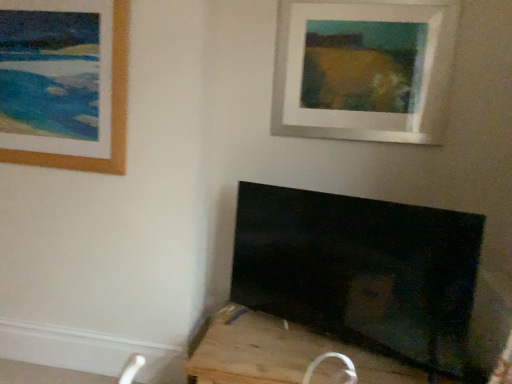
Where is `white matte picture frame at upper center, the first picture frame when ordered from right to left`? Image resolution: width=512 pixels, height=384 pixels. white matte picture frame at upper center, the first picture frame when ordered from right to left is located at coordinates (362, 70).

The image size is (512, 384). What do you see at coordinates (362, 70) in the screenshot?
I see `white matte picture frame at upper center, the second picture frame when ordered from left to right` at bounding box center [362, 70].

The image size is (512, 384). What do you see at coordinates (111, 114) in the screenshot?
I see `wooden frame at upper left, the first picture frame viewed from the left` at bounding box center [111, 114].

At what (x,y) coordinates should I click in order to perform the action: click on black matte tv at lower right. Please return your answer as a coordinate pair (x, y). The width and height of the screenshot is (512, 384). Looking at the image, I should click on (286, 355).

This screenshot has height=384, width=512. Identify the location of white matte picture frame at upper center, the second picture frame when ordered from left to right. (362, 70).

Would you say white matte picture frame at upper center, the second picture frame when ordered from left to right, is outside black matte tv at lower right?

Yes.

Identify the location of the 2nd picture frame behind the black matte tv at lower right, counting from the anchor's position. This screenshot has width=512, height=384. (362, 70).

In the image, is white matte picture frame at upper center, the second picture frame when ordered from left to right, positioned in front of or behind black matte tv at lower right?

Visually, white matte picture frame at upper center, the second picture frame when ordered from left to right, is located behind black matte tv at lower right.

From the image's perspective, who appears lower, white matte picture frame at upper center, the second picture frame when ordered from left to right, or black matte tv at lower right?

From the image's view, black matte tv at lower right is below.

Is wooden frame at upper left, the first picture frame viewed from the left, oriented towards black matte tv at lower right?

No, wooden frame at upper left, the first picture frame viewed from the left, is not oriented towards black matte tv at lower right.

Which point is more forward, (117,26) or (270,351)?

The point (270,351) is in front.

Which object is positioned more to the right, wooden frame at upper left, the 2th picture frame in the right-to-left sequence, or black matte tv at lower right?

black matte tv at lower right is more to the right.

Is the position of wooden frame at upper left, the 2th picture frame in the right-to-left sequence, more distant than that of black matte tv at lower right?

Yes, wooden frame at upper left, the 2th picture frame in the right-to-left sequence, is behind black matte tv at lower right.

Between white matte picture frame at upper center, the second picture frame when ordered from left to right, and wooden frame at upper left, the first picture frame viewed from the left, which one has more height?

Standing taller between the two is wooden frame at upper left, the first picture frame viewed from the left.

Which object is further away from the camera taking this photo, white matte picture frame at upper center, the first picture frame when ordered from right to left, or wooden frame at upper left, the first picture frame viewed from the left?

white matte picture frame at upper center, the first picture frame when ordered from right to left, is further from the camera.

Is white matte picture frame at upper center, the first picture frame when ordered from right to left, at the left side of wooden frame at upper left, the 2th picture frame in the right-to-left sequence?

Incorrect, white matte picture frame at upper center, the first picture frame when ordered from right to left, is not on the left side of wooden frame at upper left, the 2th picture frame in the right-to-left sequence.

Is white matte picture frame at upper center, the first picture frame when ordered from right to left, oriented away from wooden frame at upper left, the 2th picture frame in the right-to-left sequence?

No, white matte picture frame at upper center, the first picture frame when ordered from right to left, is not facing the opposite direction of wooden frame at upper left, the 2th picture frame in the right-to-left sequence.

Does wooden frame at upper left, the 2th picture frame in the right-to-left sequence, contain white matte picture frame at upper center, the second picture frame when ordered from left to right?

No, wooden frame at upper left, the 2th picture frame in the right-to-left sequence, does not contain white matte picture frame at upper center, the second picture frame when ordered from left to right.

Looking at this image, considering the relative positions of wooden frame at upper left, the first picture frame viewed from the left, and white matte picture frame at upper center, the first picture frame when ordered from right to left, in the image provided, is wooden frame at upper left, the first picture frame viewed from the left, behind white matte picture frame at upper center, the first picture frame when ordered from right to left,?

No, wooden frame at upper left, the first picture frame viewed from the left, is closer to the viewer.

In terms of width, does wooden frame at upper left, the 2th picture frame in the right-to-left sequence, look wider or thinner when compared to white matte picture frame at upper center, the first picture frame when ordered from right to left?

In the image, wooden frame at upper left, the 2th picture frame in the right-to-left sequence, appears to be more narrow than white matte picture frame at upper center, the first picture frame when ordered from right to left.

Is wooden frame at upper left, the 2th picture frame in the right-to-left sequence, smaller than white matte picture frame at upper center, the first picture frame when ordered from right to left?

Indeed, wooden frame at upper left, the 2th picture frame in the right-to-left sequence, has a smaller size compared to white matte picture frame at upper center, the first picture frame when ordered from right to left.

In order to click on furniture located underneath the wooden frame at upper left, the first picture frame viewed from the left (from a real-world perspective) in this screenshot , I will do `click(286, 355)`.

Which is further, (234, 378) or (96, 170)?

The point (96, 170) is more distant.

Between black matte tv at lower right and wooden frame at upper left, the 2th picture frame in the right-to-left sequence, which one appears on the right side from the viewer's perspective?

black matte tv at lower right.

This screenshot has width=512, height=384. In order to click on picture frame that is the 2nd one when counting upward from the black matte tv at lower right (from the image's perspective) in this screenshot , I will do `click(362, 70)`.

Considering the relative sizes of black matte tv at lower right and white matte picture frame at upper center, the first picture frame when ordered from right to left, in the image provided, is black matte tv at lower right bigger than white matte picture frame at upper center, the first picture frame when ordered from right to left,?

Yes, black matte tv at lower right is bigger than white matte picture frame at upper center, the first picture frame when ordered from right to left.

From their relative heights in the image, would you say black matte tv at lower right is taller or shorter than white matte picture frame at upper center, the first picture frame when ordered from right to left?

In the image, black matte tv at lower right appears to be shorter than white matte picture frame at upper center, the first picture frame when ordered from right to left.

From the picture: Which object is positioned more to the left, black matte tv at lower right or white matte picture frame at upper center, the first picture frame when ordered from right to left?

From the viewer's perspective, black matte tv at lower right appears more on the left side.

I want to click on furniture in front of the white matte picture frame at upper center, the second picture frame when ordered from left to right, so click(286, 355).

Identify the location of furniture below the wooden frame at upper left, the 2th picture frame in the right-to-left sequence (from the image's perspective). (286, 355).

Which object lies further to the anchor point wooden frame at upper left, the first picture frame viewed from the left, black matte tv at lower right or white matte picture frame at upper center, the second picture frame when ordered from left to right?

black matte tv at lower right is positioned further to the anchor wooden frame at upper left, the first picture frame viewed from the left.

Estimate the real-world distances between objects in this image. Which object is closer to black matte tv at lower right, wooden frame at upper left, the 2th picture frame in the right-to-left sequence, or white matte picture frame at upper center, the second picture frame when ordered from left to right?

wooden frame at upper left, the 2th picture frame in the right-to-left sequence, is positioned closer to the anchor black matte tv at lower right.

In the scene shown: Which object lies nearer to the anchor point black matte tv at lower right, white matte picture frame at upper center, the first picture frame when ordered from right to left, or wooden frame at upper left, the 2th picture frame in the right-to-left sequence?

The object closer to black matte tv at lower right is wooden frame at upper left, the 2th picture frame in the right-to-left sequence.

Estimate the real-world distances between objects in this image. Which object is further from white matte picture frame at upper center, the second picture frame when ordered from left to right, wooden frame at upper left, the 2th picture frame in the right-to-left sequence, or black matte tv at lower right?

black matte tv at lower right is positioned further to the anchor white matte picture frame at upper center, the second picture frame when ordered from left to right.

Considering their positions, is black matte tv at lower right positioned further to white matte picture frame at upper center, the first picture frame when ordered from right to left, than wooden frame at upper left, the 2th picture frame in the right-to-left sequence?

The object further to white matte picture frame at upper center, the first picture frame when ordered from right to left, is black matte tv at lower right.

When comparing their distances from wooden frame at upper left, the first picture frame viewed from the left, does white matte picture frame at upper center, the second picture frame when ordered from left to right, or black matte tv at lower right seem closer?

white matte picture frame at upper center, the second picture frame when ordered from left to right, is closer to wooden frame at upper left, the first picture frame viewed from the left.

Identify the location of picture frame that lies between white matte picture frame at upper center, the second picture frame when ordered from left to right, and black matte tv at lower right from top to bottom. (111, 114).